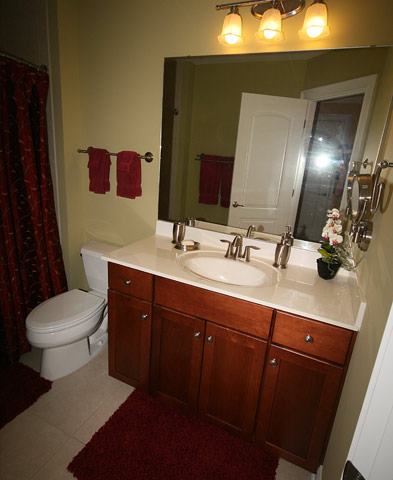
You are a GUI agent. You are given a task and a screenshot of the screen. Output one action in this format:
    pyautogui.click(x=<x>, y=<y>)
    Task: Click on the shower curtain
    This screenshot has width=393, height=480.
    Given the screenshot: What is the action you would take?
    [27, 236]